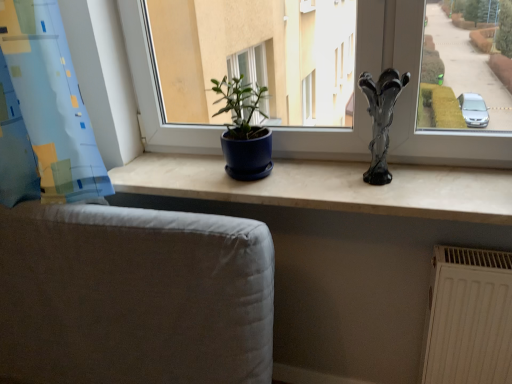
Where is `free spot to the left of transparent glass vase at right`? free spot to the left of transparent glass vase at right is located at coordinates (327, 192).